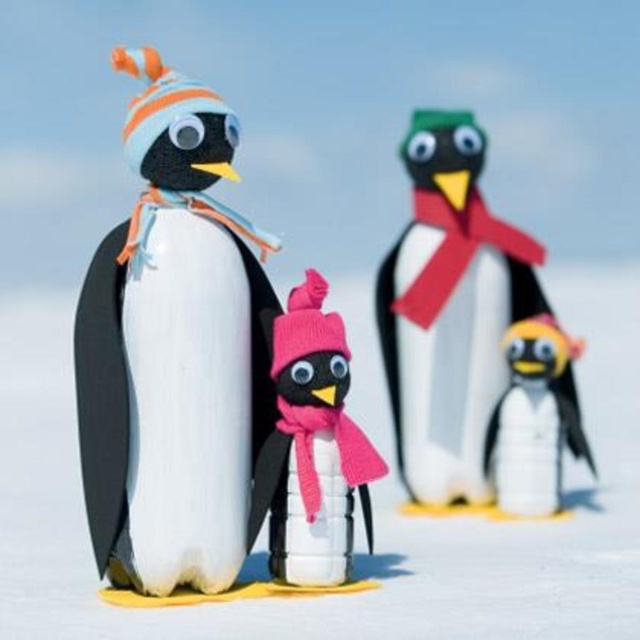
What are the coordinates of the pink knitted hat at center?

The pink knitted hat at center is located at coordinates 0.700 and 0.487.

Based on the photo, you are a bird flying over the snowy scene. Looking down, you see the matte black penguin at left and the matte yellow penguin at lower right. Which penguin is positioned higher from your viewpoint?

The matte black penguin at left is positioned higher than the matte yellow penguin at lower right from your viewpoint.